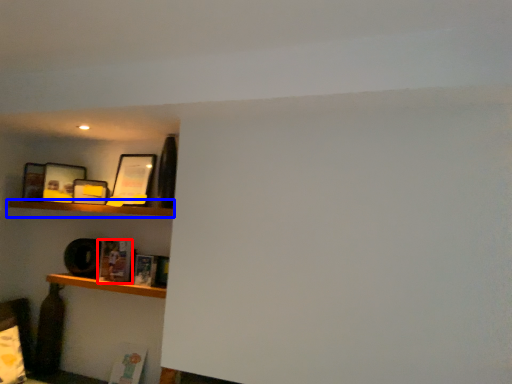
Question: Which object is further to the camera taking this photo, book (highlighted by a red box) or shelf (highlighted by a blue box)?

Choices:
 (A) book
 (B) shelf

Answer: (A)